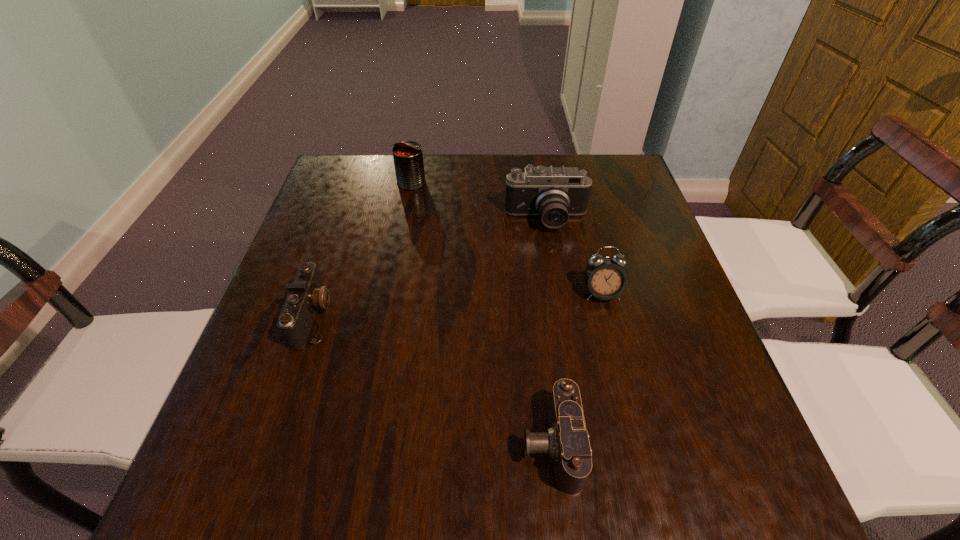
You are a GUI agent. You are given a task and a screenshot of the screen. Output one action in this format:
    pyautogui.click(x=<x>, y=<y>)
    Task: Click on the free space at the left edge
    This screenshot has height=540, width=960.
    Given the screenshot: What is the action you would take?
    pyautogui.click(x=350, y=217)

The width and height of the screenshot is (960, 540). In order to click on blank space at the right edge in this screenshot , I will do `click(631, 312)`.

Image resolution: width=960 pixels, height=540 pixels. Identify the location of free location at the far left corner of the desktop. (373, 175).

At what (x,y) coordinates should I click in order to perform the action: click on vacant space at the near left corner of the desktop. Please return your answer as a coordinate pair (x, y). The image size is (960, 540). Looking at the image, I should click on (201, 464).

You are a GUI agent. You are given a task and a screenshot of the screen. Output one action in this format:
    pyautogui.click(x=<x>, y=<y>)
    Task: Click on the free space at the far right corner
    The height and width of the screenshot is (540, 960).
    Given the screenshot: What is the action you would take?
    pyautogui.click(x=607, y=155)

Locate an element on the screen. This screenshot has width=960, height=540. free space between the alarm clock and the leftmost object is located at coordinates (458, 305).

The height and width of the screenshot is (540, 960). Identify the location of vacant point located between the farthest camera and the alarm clock. (574, 256).

Find the location of `empty space that is in between the fourth object from right to left and the tallest camera`. empty space that is in between the fourth object from right to left and the tallest camera is located at coordinates (479, 201).

I want to click on vacant area that lies between the farthest camera and the alarm clock, so click(x=574, y=256).

Locate an element on the screen. Image resolution: width=960 pixels, height=540 pixels. free area in between the farthest camera and the can is located at coordinates point(479,201).